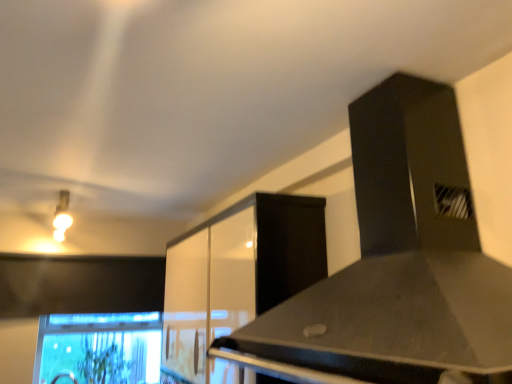
Where is `vacant space situated above black matte vent at upper right (from a real-world perspective)`? vacant space situated above black matte vent at upper right (from a real-world perspective) is located at coordinates (378, 52).